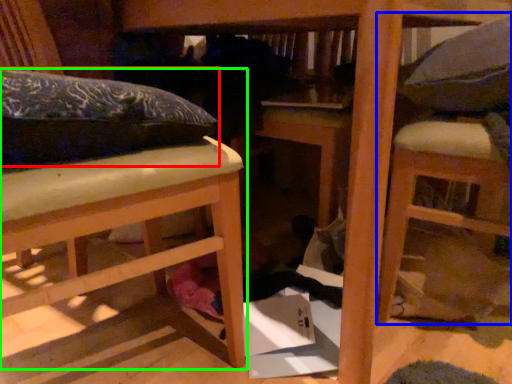
Question: Which object is the closest to the leftover (highlighted by a red box)? Choose among these: furniture (highlighted by a blue box) or furniture (highlighted by a green box).

Choices:
 (A) furniture
 (B) furniture

Answer: (B)